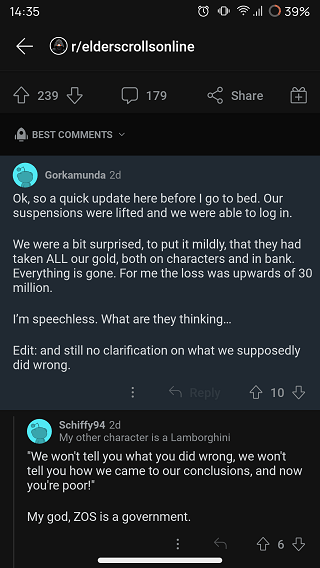
Image resolution: width=320 pixels, height=568 pixels. I want to click on alarm clock, so click(x=201, y=8).